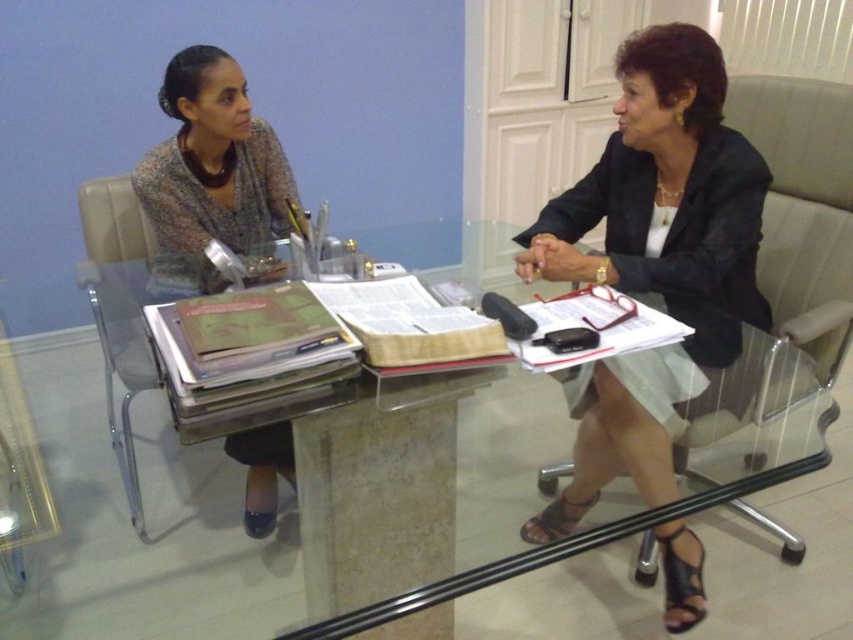
Between matte black jacket at center and black matte business suit at right, which one is positioned lower?

Positioned lower is matte black jacket at center.

Between point (618, 218) and point (643, 152), which one is positioned in front?

Point (643, 152) is more forward.

Image resolution: width=853 pixels, height=640 pixels. What do you see at coordinates (654, 260) in the screenshot?
I see `matte black jacket at center` at bounding box center [654, 260].

The width and height of the screenshot is (853, 640). Find the location of `matte black jacket at center`. matte black jacket at center is located at coordinates (654, 260).

Is point (566, 209) farther from camera compared to point (593, 545)?

Yes.

Can you confirm if black matte business suit at right is wider than transparent glass table at center?

Correct, the width of black matte business suit at right exceeds that of transparent glass table at center.

Between point (608, 182) and point (474, 257), which one is positioned behind?

Point (474, 257)

The height and width of the screenshot is (640, 853). I want to click on black matte business suit at right, so click(677, 236).

Who is shorter, matte black jacket at center or matte gray sweater at left?

With less height is matte gray sweater at left.

Is point (670, 42) positioned after point (178, 81)?

No, (670, 42) is closer to viewer.

Is point (749, 312) in front of point (155, 196)?

Yes, it is.

You are a GUI agent. You are given a task and a screenshot of the screen. Output one action in this format:
    pyautogui.click(x=<x>, y=<y>)
    Task: Click on the matte black jacket at center
    This screenshot has width=853, height=640.
    Given the screenshot: What is the action you would take?
    pyautogui.click(x=654, y=260)